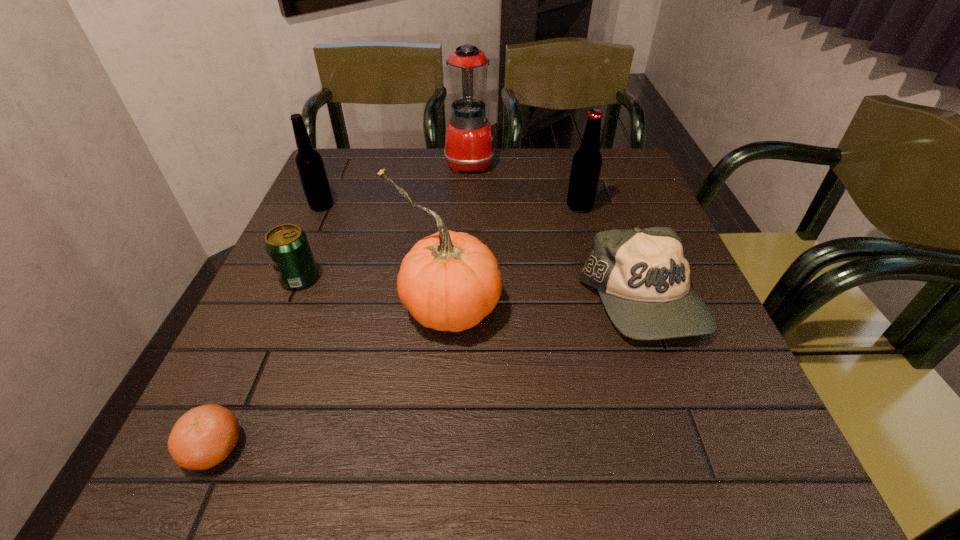
Identify the location of free space between the food processor and the baseball cap. (556, 232).

Locate an element on the screen. This screenshot has width=960, height=540. empty space between the beer can and the left beer bottle is located at coordinates (311, 242).

Where is `free spot between the left beer bottle and the right beer bottle`? This screenshot has height=540, width=960. free spot between the left beer bottle and the right beer bottle is located at coordinates (450, 206).

This screenshot has width=960, height=540. Identify the location of unoccupied position between the baseball cap and the nearest object. (428, 375).

Locate an element on the screen. The height and width of the screenshot is (540, 960). free space between the left beer bottle and the right beer bottle is located at coordinates (450, 206).

Locate an element on the screen. The width and height of the screenshot is (960, 540). unoccupied position between the beer can and the clementine is located at coordinates (257, 363).

The width and height of the screenshot is (960, 540). Find the location of `free space between the pumpkin and the right beer bottle`. free space between the pumpkin and the right beer bottle is located at coordinates (514, 256).

Select which object is the fifth closest to the beer can. Please provide its 2D coordinates. Your answer should be formatted as a tuple, i.e. [(x, y)], where the tuple contains the x and y coordinates of a point satisfying the conditions above.

[(643, 278)]

Where is `object that is the nearest to the beer can`? The image size is (960, 540). object that is the nearest to the beer can is located at coordinates (449, 281).

The height and width of the screenshot is (540, 960). What are the coordinates of `free space that satisfies the following two spatial constraints: 1. on the back side of the shortest object; 2. on the right side of the right beer bottle` in the screenshot? It's located at (322, 206).